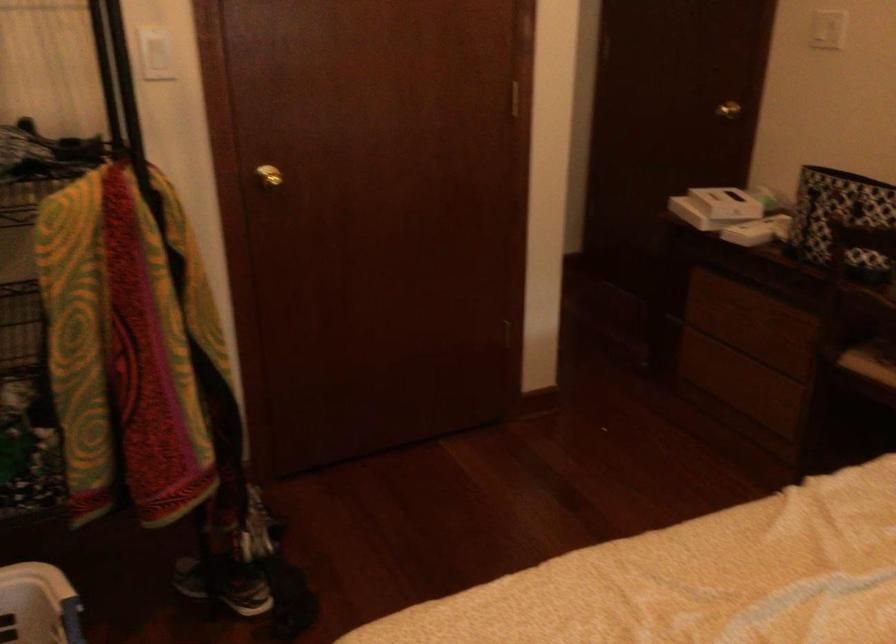
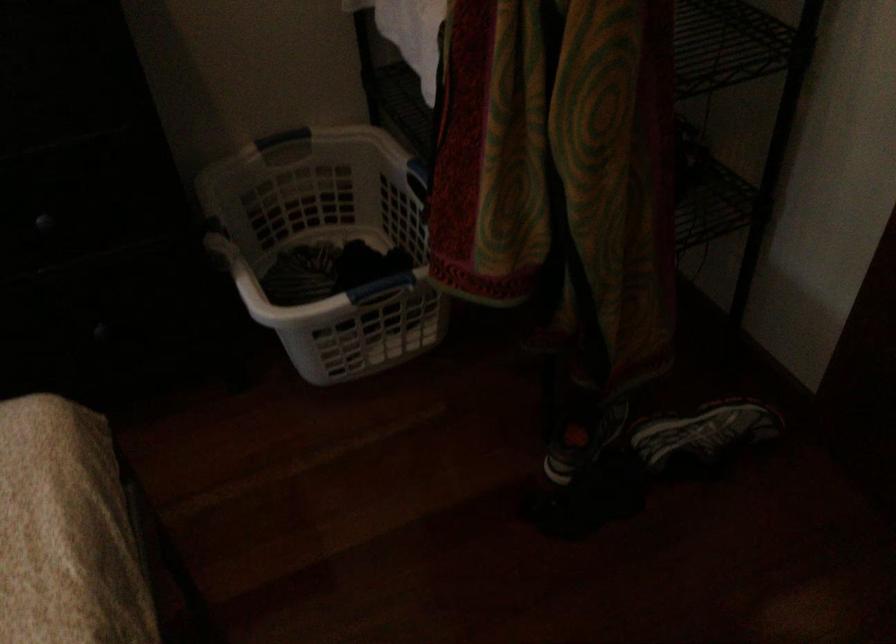
In the second image, find the point that corresponds to pixel 264 513 in the first image.

(702, 436)